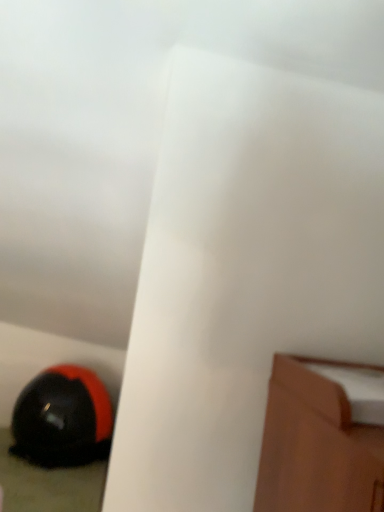
Locate an element on the screen. Image resolution: width=384 pixels, height=512 pixels. free space in front of black matte helmet at lower left is located at coordinates (52, 486).